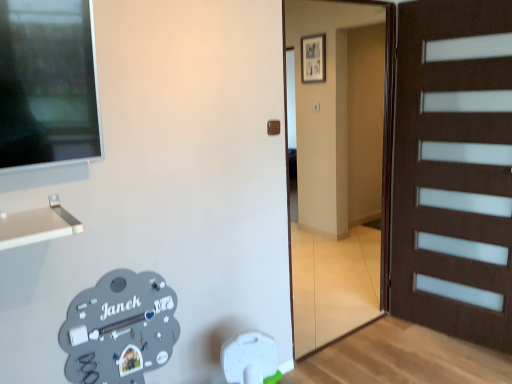
What is the approximate width of brown matte door handle at center?

1.08 inches.

What is the approximate height of brown matte door handle at center?

brown matte door handle at center is 3.53 inches tall.

What do you see at coordinates (273, 127) in the screenshot? I see `brown matte door handle at center` at bounding box center [273, 127].

In the scene shown: Measure the distance between brown matte door handle at center and camera.

brown matte door handle at center is 2.06 meters from camera.

You are a GUI agent. You are given a task and a screenshot of the screen. Output one action in this format:
    pyautogui.click(x=<x>, y=<y>)
    Task: Click on the brown matte door handle at center
    Image resolution: width=512 pixels, height=384 pixels.
    Given the screenshot: What is the action you would take?
    273,127

What are the coordinates of `brown wooden door at center` in the screenshot? It's located at (338, 168).

Describe the element at coordinates (338, 168) in the screenshot. I see `brown wooden door at center` at that location.

What is the approximate height of brown wooden door at center?

It is 2.03 meters.

Where is `brown matte door handle at center`? Image resolution: width=512 pixels, height=384 pixels. brown matte door handle at center is located at coordinates (273, 127).

Which is more to the right, brown wooden door at center or brown matte door handle at center?

brown wooden door at center is more to the right.

Is brown wooden door at center further to camera compared to brown matte door handle at center?

No, brown wooden door at center is in front of brown matte door handle at center.

Is point (381, 165) behind point (273, 127)?

Yes, point (381, 165) is behind point (273, 127).

From the image's perspective, is brown wooden door at center below brown matte door handle at center?

Indeed, from the image's perspective, brown wooden door at center is shown beneath brown matte door handle at center.

From a real-world perspective, is brown wooden door at center physically below brown matte door handle at center?

Yes.

Is brown wooden door at center thinner than brown matte door handle at center?

No.

Is brown wooden door at center taller or shorter than brown matte door handle at center?

brown wooden door at center is taller than brown matte door handle at center.

Can you confirm if brown wooden door at center is smaller than brown matte door handle at center?

No, brown wooden door at center is not smaller than brown matte door handle at center.

Does brown wooden door at center contain brown matte door handle at center?

No, brown matte door handle at center is located outside of brown wooden door at center.

Looking at this image, is brown wooden door at center positioned far away from brown matte door handle at center?

Absolutely, brown wooden door at center is distant from brown matte door handle at center.

Is brown wooden door at center looking in the opposite direction of brown matte door handle at center?

That's not correct — brown wooden door at center is not looking away from brown matte door handle at center.

Can you tell me how much brown wooden door at center and brown matte door handle at center differ in facing direction?

The angle between the facing direction of brown wooden door at center and the facing direction of brown matte door handle at center is 0.129 degrees.

How far apart are brown wooden door at center and brown matte door handle at center?

7.58 feet.

You are a GUI agent. You are given a task and a screenshot of the screen. Output one action in this format:
    pyautogui.click(x=<x>, y=<y>)
    Task: Click on the door handle lying behind the brown wooden door at center
    This screenshot has width=512, height=384.
    Given the screenshot: What is the action you would take?
    pyautogui.click(x=273, y=127)

Visually, is brown matte door handle at center positioned to the left or to the right of brown wooden door at center?

brown matte door handle at center is to the left of brown wooden door at center.

From the picture: Relative to brown wooden door at center, is brown matte door handle at center in front or behind?

brown matte door handle at center is positioned farther from the viewer than brown wooden door at center.

Considering the positions of point (277, 120) and point (362, 295), is point (277, 120) closer or farther from the camera than point (362, 295)?

Point (277, 120).

From the image's perspective, is brown matte door handle at center over brown wooden door at center?

Yes, from the image's perspective, brown matte door handle at center is over brown wooden door at center.

From a real-world perspective, between brown matte door handle at center and brown wooden door at center, who is vertically lower?

From a 3D spatial view, brown wooden door at center is below.

Considering the sizes of brown matte door handle at center and brown wooden door at center in the image, is brown matte door handle at center wider or thinner than brown wooden door at center?

Clearly, brown matte door handle at center has less width compared to brown wooden door at center.

Considering the sizes of objects brown matte door handle at center and brown wooden door at center in the image provided, who is taller, brown matte door handle at center or brown wooden door at center?

With more height is brown wooden door at center.

Is brown matte door handle at center bigger than brown wooden door at center?

Incorrect, brown matte door handle at center is not larger than brown wooden door at center.

Is brown matte door handle at center spatially inside brown wooden door at center, or outside of it?

brown matte door handle at center is outside brown wooden door at center.

Is brown matte door handle at center positioned far away from brown wooden door at center?

Yes, brown matte door handle at center and brown wooden door at center are quite far apart.

Is brown matte door handle at center oriented towards brown wooden door at center?

No, brown matte door handle at center is not facing towards brown wooden door at center.

Image resolution: width=512 pixels, height=384 pixels. I want to click on garage door below the brown matte door handle at center (from the image's perspective), so click(x=338, y=168).

Identify the location of garage door that is under the brown matte door handle at center (from a real-world perspective). The width and height of the screenshot is (512, 384). (338, 168).

I want to click on door handle above the brown wooden door at center (from a real-world perspective), so click(273, 127).